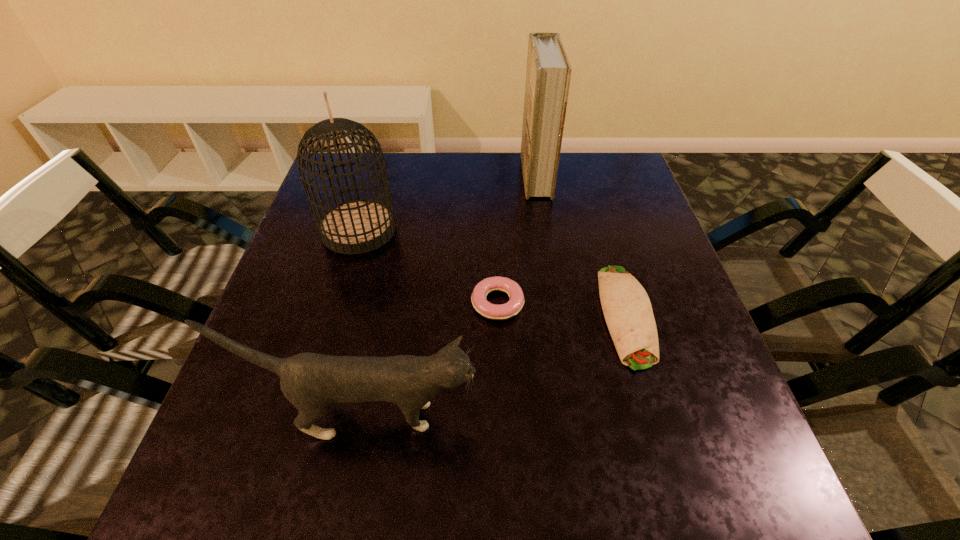
I want to click on vacant point at the left edge, so click(x=235, y=431).

The width and height of the screenshot is (960, 540). Identify the location of free space at the right edge of the desktop. (600, 213).

The height and width of the screenshot is (540, 960). Find the location of `free space at the far right corner of the desktop`. free space at the far right corner of the desktop is located at coordinates (582, 187).

In order to click on free space between the fourth nearest object and the doughnut in this screenshot , I will do `click(428, 266)`.

Identify the location of vacant area that lies between the burrito and the birdcage. (492, 272).

Image resolution: width=960 pixels, height=540 pixels. I want to click on free space between the shortest object and the farthest object, so click(x=516, y=240).

Identify the location of free area in between the burrito and the fourth nearest object. This screenshot has width=960, height=540. (492, 272).

The width and height of the screenshot is (960, 540). What are the coordinates of `empty space that is in between the birdcage and the doughnut` in the screenshot? It's located at (428, 266).

Find the location of a particular element. The width and height of the screenshot is (960, 540). empty location between the fourth nearest object and the shortest object is located at coordinates (428, 266).

Locate an element on the screen. free space between the birdcage and the shortest object is located at coordinates (428, 266).